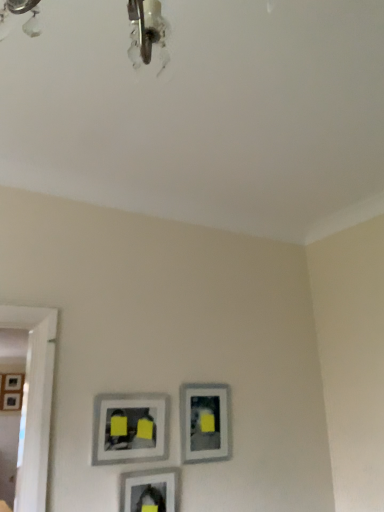
What is the approximate width of matte gray picture frame at center, which is the fourth picture frame in bottom-to-top order?

matte gray picture frame at center, which is the fourth picture frame in bottom-to-top order, is 1.05 inches wide.

The image size is (384, 512). I want to click on matte gray picture frame at center, which is the 2th picture frame in front-to-back order, so click(130, 428).

The width and height of the screenshot is (384, 512). What do you see at coordinates (12, 392) in the screenshot? I see `matte gray picture frame at left, which ranks as the first picture frame in back-to-front order` at bounding box center [12, 392].

In order to face matte gray picture frame at lower center, which is the 1th picture frame in front-to-back order, should I rotate leftwards or rightwards?

A 5.279 degree turn to the left will do.

Image resolution: width=384 pixels, height=512 pixels. What are the coordinates of `matte gray picture frame at center, positioned as the first picture frame in right-to-left order` in the screenshot? It's located at click(205, 422).

Could you measure the distance between matte gray picture frame at left, which is the 4th picture frame from top to bottom, and matte gray picture frame at center, arranged as the 3th picture frame when viewed from the front?

matte gray picture frame at left, which is the 4th picture frame from top to bottom, is 1.96 meters away from matte gray picture frame at center, arranged as the 3th picture frame when viewed from the front.

Considering the sizes of objects matte gray picture frame at left, placed as the 4th picture frame when sorted from front to back, and matte gray picture frame at center, which ranks as the second picture frame in back-to-front order, in the image provided, who is shorter, matte gray picture frame at left, placed as the 4th picture frame when sorted from front to back, or matte gray picture frame at center, which ranks as the second picture frame in back-to-front order,?

Standing shorter between the two is matte gray picture frame at center, which ranks as the second picture frame in back-to-front order.

Does point (18, 380) appear closer or farther from the camera than point (219, 405)?

Point (18, 380) is farther from the camera than point (219, 405).

From a real-world perspective, is matte gray picture frame at left, placed as the 4th picture frame when sorted from front to back, positioned above or below matte gray picture frame at center, marked as the 3th picture frame in a bottom-to-top arrangement?

From a real-world perspective, matte gray picture frame at left, placed as the 4th picture frame when sorted from front to back, is physically above matte gray picture frame at center, marked as the 3th picture frame in a bottom-to-top arrangement.

Is matte gray picture frame at center, which is counted as the 4th picture frame, starting from the left, completely or partially outside of matte gray picture frame at center, which is the fourth picture frame in bottom-to-top order?

Yes, matte gray picture frame at center, which is counted as the 4th picture frame, starting from the left, is outside of matte gray picture frame at center, which is the fourth picture frame in bottom-to-top order.

From a real-world perspective, between matte gray picture frame at center, marked as the 3th picture frame in a bottom-to-top arrangement, and matte gray picture frame at center, which is the 2th picture frame in front-to-back order, who is vertically lower?

matte gray picture frame at center, which is the 2th picture frame in front-to-back order.

Does matte gray picture frame at center, which ranks as the second picture frame in back-to-front order, have a greater height compared to matte gray picture frame at center, positioned as the first picture frame in top-to-bottom order?

Yes.

Between matte gray picture frame at lower center, the 3th picture frame viewed from the top, and matte gray picture frame at center, which is the fourth picture frame in bottom-to-top order, which one appears on the right side from the viewer's perspective?

matte gray picture frame at lower center, the 3th picture frame viewed from the top, is more to the right.

From the image's perspective, is matte gray picture frame at lower center, placed as the fourth picture frame when sorted from back to front, on top of matte gray picture frame at center, acting as the 3th picture frame starting from the right?

Incorrect, from the image's perspective, matte gray picture frame at lower center, placed as the fourth picture frame when sorted from back to front, is lower than matte gray picture frame at center, acting as the 3th picture frame starting from the right.

From the matte gray picture frame at center, which is the fourth picture frame in bottom-to-top order, count 1st picture frame to the right and point to it. Please provide its 2D coordinates.

[(149, 490)]

Considering the sizes of matte gray picture frame at left, which ranks as the first picture frame in bottom-to-top order, and matte gray picture frame at lower center, which is the third picture frame from left to right, in the image, is matte gray picture frame at left, which ranks as the first picture frame in bottom-to-top order, bigger or smaller than matte gray picture frame at lower center, which is the third picture frame from left to right,?

In the image, matte gray picture frame at left, which ranks as the first picture frame in bottom-to-top order, appears to be larger than matte gray picture frame at lower center, which is the third picture frame from left to right.

Is matte gray picture frame at left, which is the 4th picture frame from top to bottom, taller than matte gray picture frame at lower center, which is the 2th picture frame in right-to-left order?

Yes, matte gray picture frame at left, which is the 4th picture frame from top to bottom, is taller than matte gray picture frame at lower center, which is the 2th picture frame in right-to-left order.

Consider the image. Is matte gray picture frame at left, which ranks as the first picture frame in bottom-to-top order, oriented towards matte gray picture frame at lower center, placed as the fourth picture frame when sorted from back to front?

Yes, matte gray picture frame at left, which ranks as the first picture frame in bottom-to-top order, is turned towards matte gray picture frame at lower center, placed as the fourth picture frame when sorted from back to front.

Considering the sizes of objects matte gray picture frame at left, the 1th picture frame when ordered from left to right, and matte gray picture frame at lower center, which is the third picture frame from left to right, in the image provided, who is thinner, matte gray picture frame at left, the 1th picture frame when ordered from left to right, or matte gray picture frame at lower center, which is the third picture frame from left to right,?

matte gray picture frame at lower center, which is the third picture frame from left to right, is thinner.

Is the surface of matte gray picture frame at center, placed as the 2th picture frame when sorted from left to right, in direct contact with matte gray picture frame at left, which is the 4th picture frame from top to bottom?

No, matte gray picture frame at center, placed as the 2th picture frame when sorted from left to right, is not in contact with matte gray picture frame at left, which is the 4th picture frame from top to bottom.

Between matte gray picture frame at center, acting as the 3th picture frame starting from the right, and matte gray picture frame at left, which is the 4th picture frame from top to bottom, which one has smaller width?

Thinner between the two is matte gray picture frame at center, acting as the 3th picture frame starting from the right.

From a real-world perspective, does matte gray picture frame at center, which is the 2th picture frame in front-to-back order, stand above matte gray picture frame at left, placed as the 4th picture frame when sorted from front to back?

No, from a real-world perspective, matte gray picture frame at center, which is the 2th picture frame in front-to-back order, is not above matte gray picture frame at left, placed as the 4th picture frame when sorted from front to back.

Between matte gray picture frame at center, placed as the 2th picture frame when sorted from left to right, and matte gray picture frame at left, which ranks as the first picture frame in bottom-to-top order, which one has more height?

matte gray picture frame at left, which ranks as the first picture frame in bottom-to-top order, is taller.

Does matte gray picture frame at center, which ranks as the second picture frame in back-to-front order, touch matte gray picture frame at lower center, placed as the 2th picture frame when sorted from bottom to top?

No, matte gray picture frame at center, which ranks as the second picture frame in back-to-front order, is not beside matte gray picture frame at lower center, placed as the 2th picture frame when sorted from bottom to top.

Is matte gray picture frame at center, marked as the 3th picture frame in a bottom-to-top arrangement, shorter than matte gray picture frame at lower center, which is the 2th picture frame in right-to-left order?

Yes, matte gray picture frame at center, marked as the 3th picture frame in a bottom-to-top arrangement, is shorter than matte gray picture frame at lower center, which is the 2th picture frame in right-to-left order.

From the image's perspective, count 1st picture frames upward from the matte gray picture frame at lower center, placed as the 2th picture frame when sorted from bottom to top, and point to it. Please provide its 2D coordinates.

[(205, 422)]

Based on their positions, is matte gray picture frame at center, which is the fourth picture frame in bottom-to-top order, located to the left or right of matte gray picture frame at lower center, which is the 1th picture frame in front-to-back order?

Clearly, matte gray picture frame at center, which is the fourth picture frame in bottom-to-top order, is on the left of matte gray picture frame at lower center, which is the 1th picture frame in front-to-back order, in the image.

Which object is thinner, matte gray picture frame at center, which is the 2th picture frame in front-to-back order, or matte gray picture frame at lower center, the 3th picture frame viewed from the top?

Thinner between the two is matte gray picture frame at center, which is the 2th picture frame in front-to-back order.

Is matte gray picture frame at center, which is the fourth picture frame in bottom-to-top order, positioned beyond the bounds of matte gray picture frame at lower center, placed as the fourth picture frame when sorted from back to front?

matte gray picture frame at center, which is the fourth picture frame in bottom-to-top order, is positioned outside matte gray picture frame at lower center, placed as the fourth picture frame when sorted from back to front.

From the picture: Is matte gray picture frame at center, which is the fourth picture frame in bottom-to-top order, closer to the viewer compared to matte gray picture frame at lower center, the 3th picture frame viewed from the top?

No, matte gray picture frame at center, which is the fourth picture frame in bottom-to-top order, is behind matte gray picture frame at lower center, the 3th picture frame viewed from the top.

I want to click on the 1st picture frame in front of the matte gray picture frame at left, which is the 4th picture frame in right-to-left order, so (205, 422).

Locate an element on the screen. This screenshot has width=384, height=512. picture frame that is the 1st one when counting backward from the matte gray picture frame at center, acting as the 3th picture frame starting from the right is located at coordinates (205, 422).

Consider the image. From the image, which object appears to be farther from matte gray picture frame at center, placed as the 2th picture frame when sorted from left to right, matte gray picture frame at lower center, the 3th picture frame viewed from the top, or matte gray picture frame at center, positioned as the first picture frame in right-to-left order?

matte gray picture frame at center, positioned as the first picture frame in right-to-left order.

Estimate the real-world distances between objects in this image. Which object is further from matte gray picture frame at lower center, the 3th picture frame viewed from the top, matte gray picture frame at center, which ranks as the second picture frame in back-to-front order, or matte gray picture frame at left, which ranks as the first picture frame in back-to-front order?

Among the two, matte gray picture frame at left, which ranks as the first picture frame in back-to-front order, is located further to matte gray picture frame at lower center, the 3th picture frame viewed from the top.

Based on their spatial positions, is matte gray picture frame at left, the 1th picture frame when ordered from left to right, or matte gray picture frame at lower center, placed as the 2th picture frame when sorted from bottom to top, further from matte gray picture frame at center, marked as the 3th picture frame in a bottom-to-top arrangement?

Based on the image, matte gray picture frame at left, the 1th picture frame when ordered from left to right, appears to be further to matte gray picture frame at center, marked as the 3th picture frame in a bottom-to-top arrangement.

Which object lies nearer to the anchor point matte gray picture frame at center, positioned as the first picture frame in top-to-bottom order, matte gray picture frame at center, marked as the 3th picture frame in a bottom-to-top arrangement, or matte gray picture frame at left, the 1th picture frame when ordered from left to right?

matte gray picture frame at center, marked as the 3th picture frame in a bottom-to-top arrangement.

Looking at the image, which one is located closer to matte gray picture frame at center, positioned as the first picture frame in right-to-left order, matte gray picture frame at lower center, placed as the fourth picture frame when sorted from back to front, or matte gray picture frame at left, which ranks as the first picture frame in back-to-front order?

matte gray picture frame at lower center, placed as the fourth picture frame when sorted from back to front, is closer to matte gray picture frame at center, positioned as the first picture frame in right-to-left order.

Looking at this image, looking at the image, which one is located further to matte gray picture frame at center, acting as the 3th picture frame starting from the right, matte gray picture frame at left, which is the 4th picture frame from top to bottom, or matte gray picture frame at center, positioned as the first picture frame in right-to-left order?

matte gray picture frame at left, which is the 4th picture frame from top to bottom, is further to matte gray picture frame at center, acting as the 3th picture frame starting from the right.

When comparing their distances from matte gray picture frame at lower center, placed as the fourth picture frame when sorted from back to front, does matte gray picture frame at center, placed as the second picture frame when sorted from top to bottom, or matte gray picture frame at center, which is the fourth picture frame in bottom-to-top order, seem further?

matte gray picture frame at center, placed as the second picture frame when sorted from top to bottom, is positioned further to the anchor matte gray picture frame at lower center, placed as the fourth picture frame when sorted from back to front.

Considering their positions, is matte gray picture frame at lower center, which is the 2th picture frame in right-to-left order, positioned further to matte gray picture frame at center, positioned as the first picture frame in right-to-left order, than matte gray picture frame at center, acting as the 3th picture frame starting from the right?

matte gray picture frame at lower center, which is the 2th picture frame in right-to-left order, lies further to matte gray picture frame at center, positioned as the first picture frame in right-to-left order, than the other object.

Image resolution: width=384 pixels, height=512 pixels. In order to click on picture frame between matte gray picture frame at center, acting as the 3th picture frame starting from the right, and matte gray picture frame at lower center, placed as the 2th picture frame when sorted from bottom to top, in the up-down direction in this screenshot , I will do `click(205, 422)`.

Where is `picture frame located between matte gray picture frame at center, placed as the 2th picture frame when sorted from left to right, and matte gray picture frame at left, which is the 4th picture frame from top to bottom, in the depth direction`? This screenshot has width=384, height=512. picture frame located between matte gray picture frame at center, placed as the 2th picture frame when sorted from left to right, and matte gray picture frame at left, which is the 4th picture frame from top to bottom, in the depth direction is located at coordinates (205, 422).